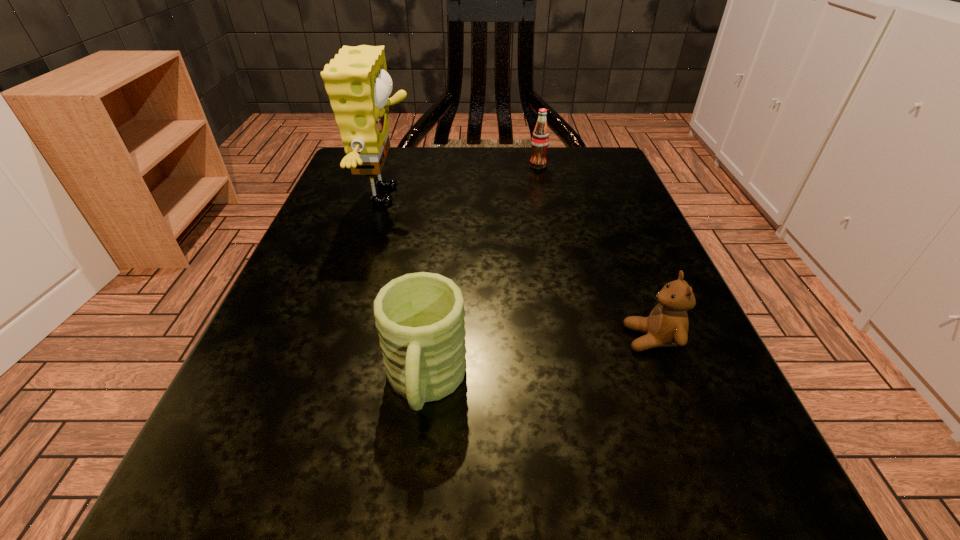
Find the location of a particular element. This screenshot has height=540, width=960. vacant space located 0.130m on the front-facing side of the rightmost object is located at coordinates (526, 339).

You are a GUI agent. You are given a task and a screenshot of the screen. Output one action in this format:
    pyautogui.click(x=<x>, y=<y>)
    Task: Click on the vacant region located on the front-facing side of the rightmost object
    The image size is (960, 540).
    Given the screenshot: What is the action you would take?
    pyautogui.click(x=372, y=339)

Image resolution: width=960 pixels, height=540 pixels. What are the coordinates of `sponge located in the far edge section of the desktop` in the screenshot? It's located at (356, 80).

Find the location of a particular element. The height and width of the screenshot is (540, 960). soda that is at the far edge is located at coordinates [x=540, y=138].

In order to click on object that is at the left edge in this screenshot , I will do `click(356, 80)`.

The image size is (960, 540). I want to click on soda at the right edge, so click(x=540, y=138).

You are a GUI agent. You are given a task and a screenshot of the screen. Output one action in this format:
    pyautogui.click(x=<x>, y=<y>)
    Task: Click on the teddy bear that is at the right edge
    This screenshot has width=960, height=540.
    Given the screenshot: What is the action you would take?
    pyautogui.click(x=667, y=325)

This screenshot has height=540, width=960. What are the coordinates of `object positioned at the far left corner` in the screenshot? It's located at (356, 80).

Where is `object situated at the far right corner`? object situated at the far right corner is located at coordinates (540, 138).

Where is `vacant position at the far edge of the desktop`? The height and width of the screenshot is (540, 960). vacant position at the far edge of the desktop is located at coordinates (521, 148).